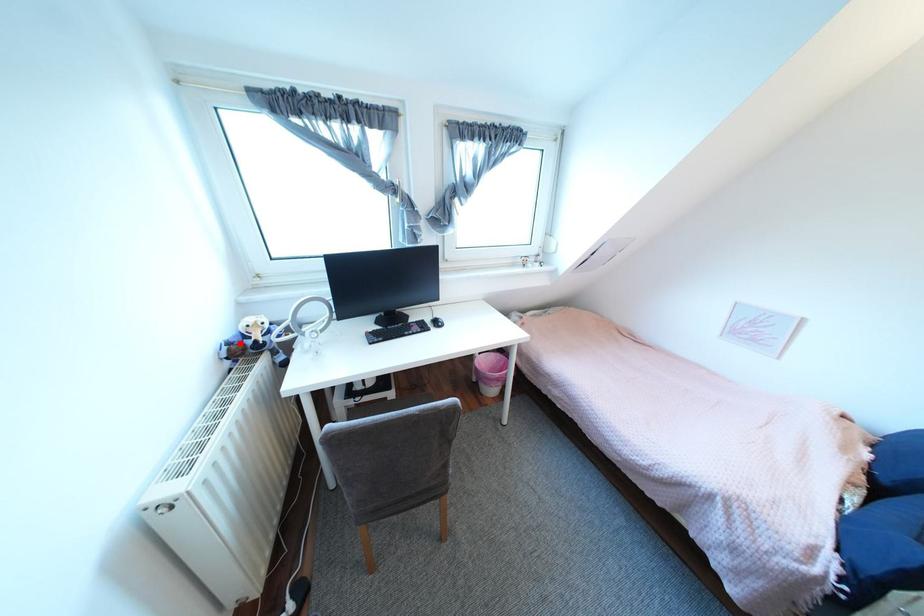
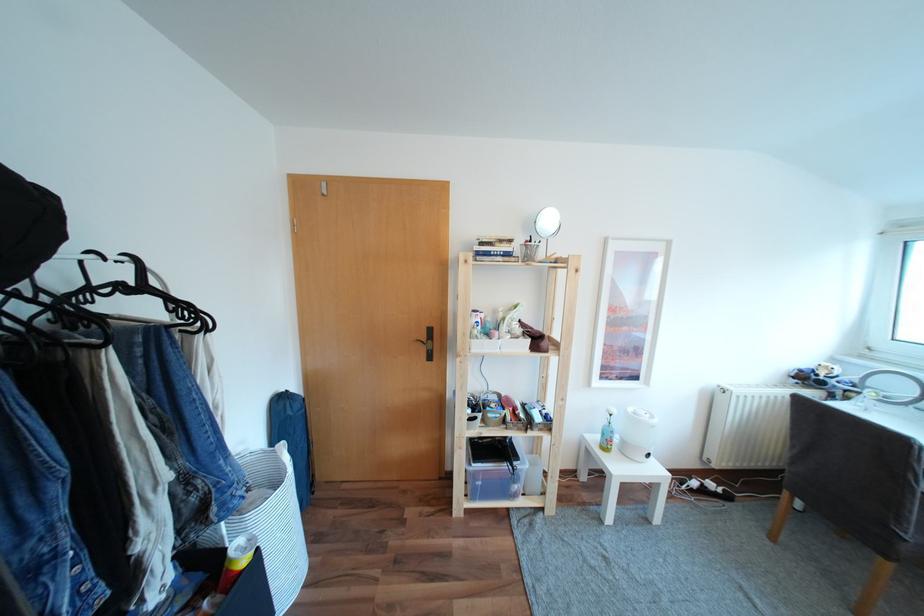
Find the pixel in the second image that matches the highlighted location in the first image.

(810, 371)